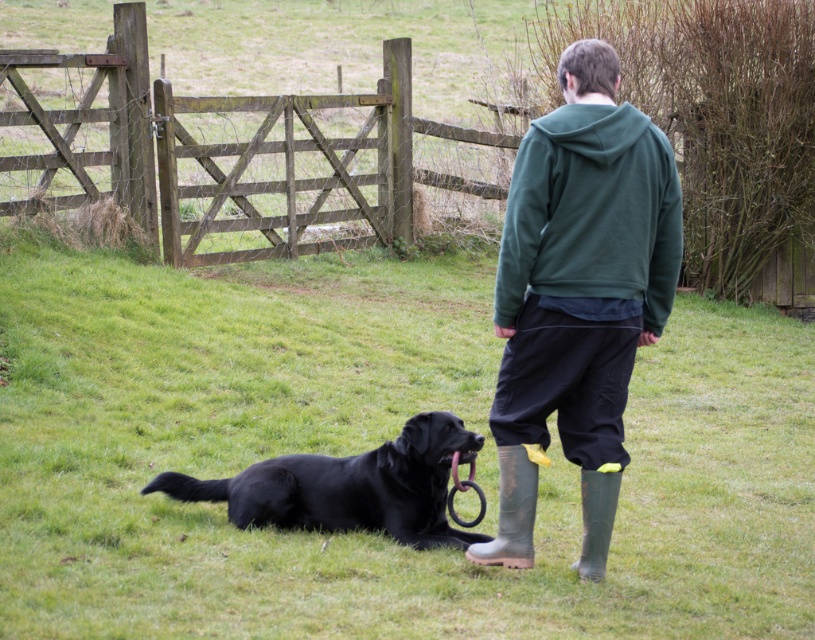
Based on the photo, does green matte hoodie at center have a greater width compared to green fleece sweatshirt at upper center?

Yes, green matte hoodie at center is wider than green fleece sweatshirt at upper center.

The width and height of the screenshot is (815, 640). What do you see at coordinates (578, 296) in the screenshot? I see `green matte hoodie at center` at bounding box center [578, 296].

Identify the location of green matte hoodie at center. click(578, 296).

Looking at this image, which of these two, wooden gate at center or rubber/muddy boot at lower center, stands shorter?

rubber/muddy boot at lower center

Between wooden gate at center and rubber/muddy boot at lower center, which one has more height?

Standing taller between the two is wooden gate at center.

Does point (385, 102) come behind point (504, 490)?

Yes, it is.

The height and width of the screenshot is (640, 815). I want to click on wooden gate at center, so click(x=236, y=156).

Between green fleece sweatshirt at upper center and green rubber boot at lower right, which one appears on the left side from the viewer's perspective?

green fleece sweatshirt at upper center is more to the left.

Locate an element on the screen. green fleece sweatshirt at upper center is located at coordinates (591, 212).